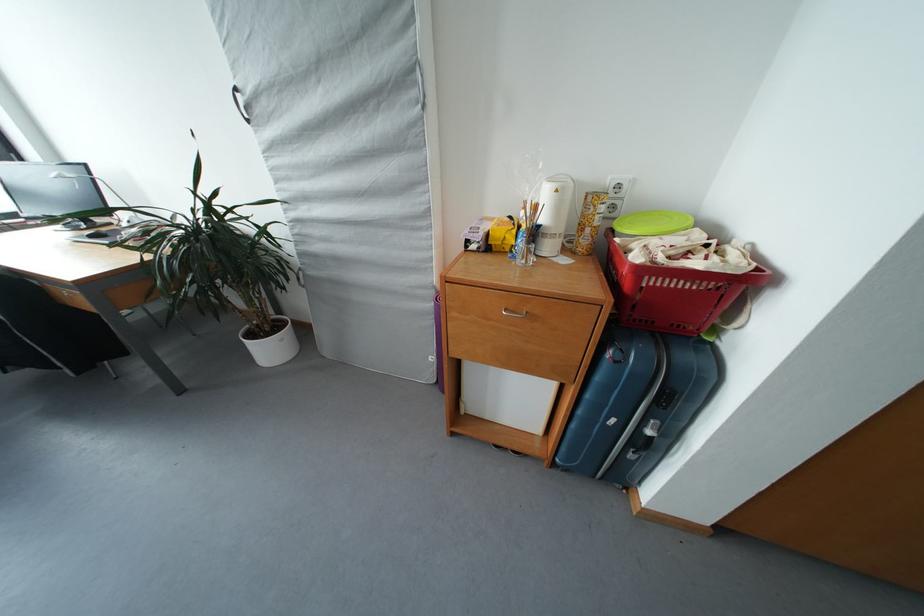
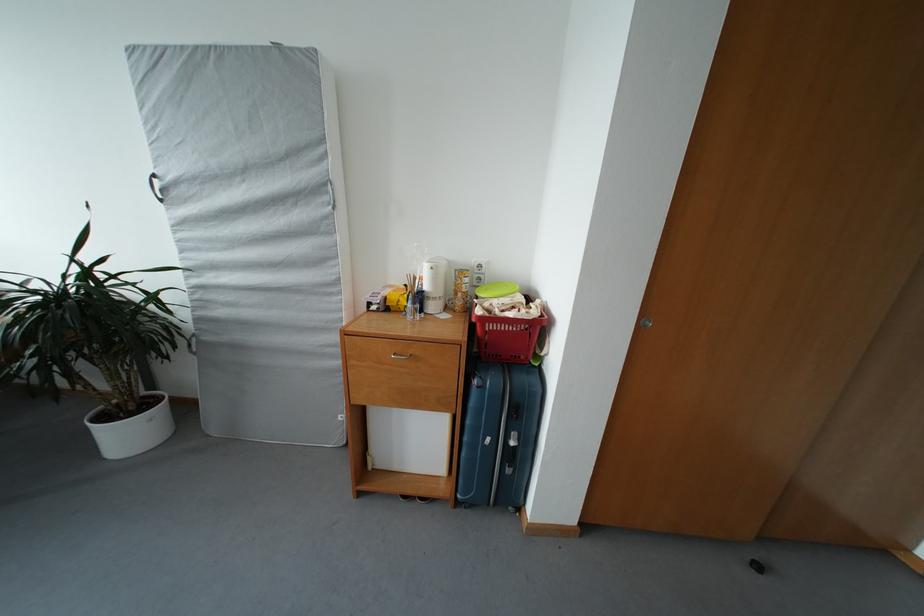
The point at [590,235] is marked in the first image. Where is the corresponding point in the second image?

(463, 300)